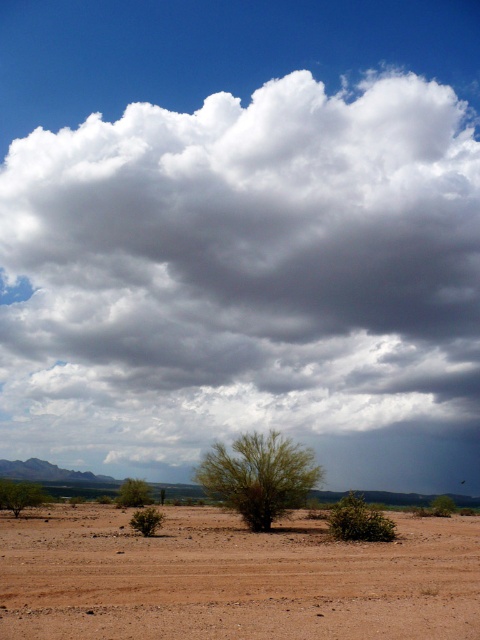
Does cloudy white cloud at upper center have a greater width compared to green leafy bush at lower right?

Yes, cloudy white cloud at upper center is wider than green leafy bush at lower right.

Is point (40, 385) farther from camera compared to point (348, 502)?

Yes, it is behind point (348, 502).

Between point (448, 381) and point (363, 502), which one is positioned in front?

Positioned in front is point (363, 502).

Find the location of a particular element. This screenshot has width=480, height=640. cloudy white cloud at upper center is located at coordinates (241, 273).

Can you confirm if brown sandy dirt field at lower center is shorter than green leafy bush at lower center?

Yes, brown sandy dirt field at lower center is shorter than green leafy bush at lower center.

Is point (200, 618) less distant than point (120, 484)?

Yes, it is in front of point (120, 484).

At what (x,y) coordinates should I click in order to perform the action: click on brown sandy dirt field at lower center. Please return your answer as a coordinate pair (x, y). Looking at the image, I should click on (233, 579).

Who is lower down, brown sandy dirt field at lower center or green leafy bush at center?

brown sandy dirt field at lower center

Which is above, brown sandy dirt field at lower center or green leafy bush at center?

green leafy bush at center is above.

Between point (355, 611) and point (276, 480), which one is positioned in front?

Positioned in front is point (355, 611).

This screenshot has width=480, height=640. In order to click on brown sandy dirt field at lower center in this screenshot , I will do `click(233, 579)`.